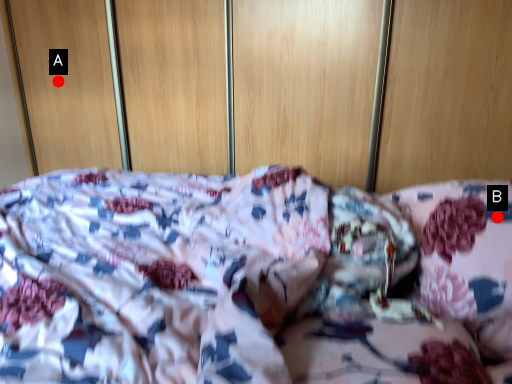
Question: Two points are circled on the image, labeled by A and B beside each circle. Which point appears closest to the camera in this image?

Choices:
 (A) A is closer
 (B) B is closer

Answer: (B)